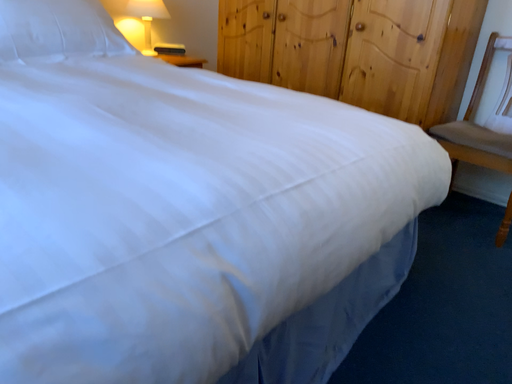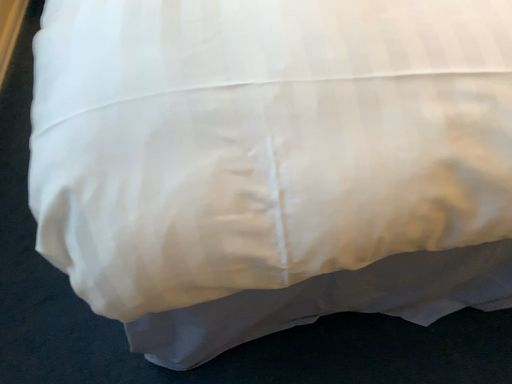
Question: Which way did the camera rotate in the video?

Choices:
 (A) rotated right
 (B) rotated left

Answer: (B)